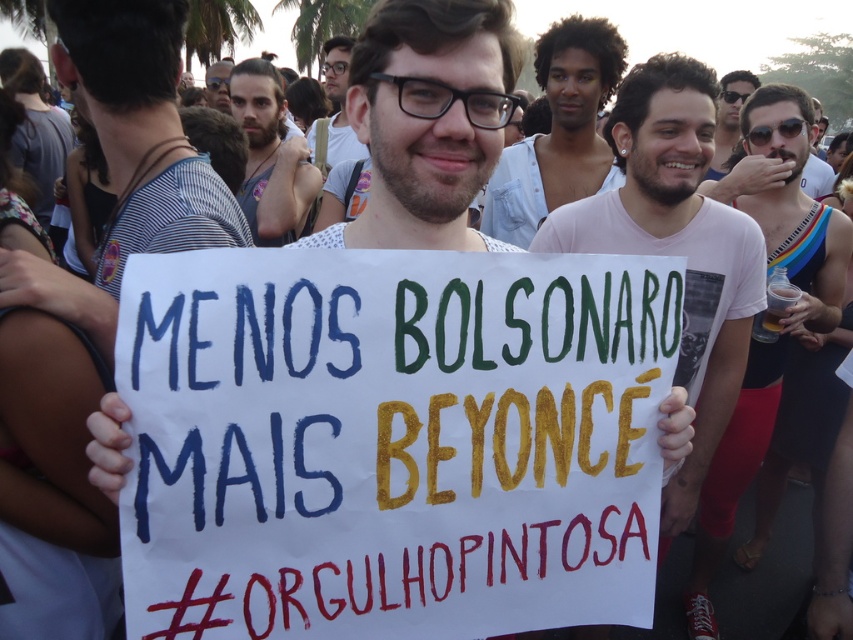
Does light blue shirt at center have a lesser width compared to gray tank top at center?

No, light blue shirt at center is not thinner than gray tank top at center.

Locate an element on the screen. Image resolution: width=853 pixels, height=640 pixels. light blue shirt at center is located at coordinates (558, 132).

Does light blue shirt at center come in front of matte black shirt at center?

That is True.

Who is more forward, (543, 72) or (207, 68)?

Point (543, 72)

Describe the element at coordinates (558, 132) in the screenshot. The width and height of the screenshot is (853, 640). I see `light blue shirt at center` at that location.

Find the location of a particular element. Image resolution: width=853 pixels, height=640 pixels. light blue shirt at center is located at coordinates (558, 132).

Image resolution: width=853 pixels, height=640 pixels. I want to click on pink cotton t-shirt at center, so click(676, 246).

Who is more forward, (711,314) or (274,147)?

Point (711,314) is in front.

Does point (706, 369) come behind point (252, 84)?

No, (706, 369) is in front of (252, 84).

This screenshot has width=853, height=640. I want to click on pink cotton t-shirt at center, so coord(676,246).